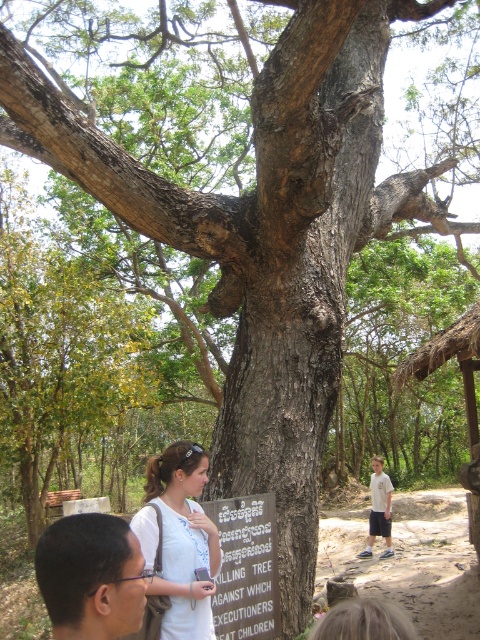
Question: Is light brown hair at lower center above wooden signboard at center?

Choices:
 (A) no
 (B) yes

Answer: (B)

Question: Among these objects, which one is farthest from the camera?

Choices:
 (A) light brown hair at lower center
 (B) black hair at lower left

Answer: (A)

Question: Which point is closer to the camera taking this photo?

Choices:
 (A) (205, 580)
 (B) (113, 572)
 (C) (373, 468)
 (D) (215, 596)

Answer: (B)

Question: Can you confirm if light brown hair at lower center is wider than light beige cotton t-shirt at lower right?

Choices:
 (A) yes
 (B) no

Answer: (B)

Question: Which object is closer to the camera taking this photo?

Choices:
 (A) light brown hair at lower center
 (B) black hair at lower left
 (C) light beige cotton t-shirt at lower right
 (D) wooden signboard at center

Answer: (B)

Question: Can you confirm if light brown hair at lower center is positioned to the left of light beige cotton t-shirt at lower right?

Choices:
 (A) yes
 (B) no

Answer: (A)